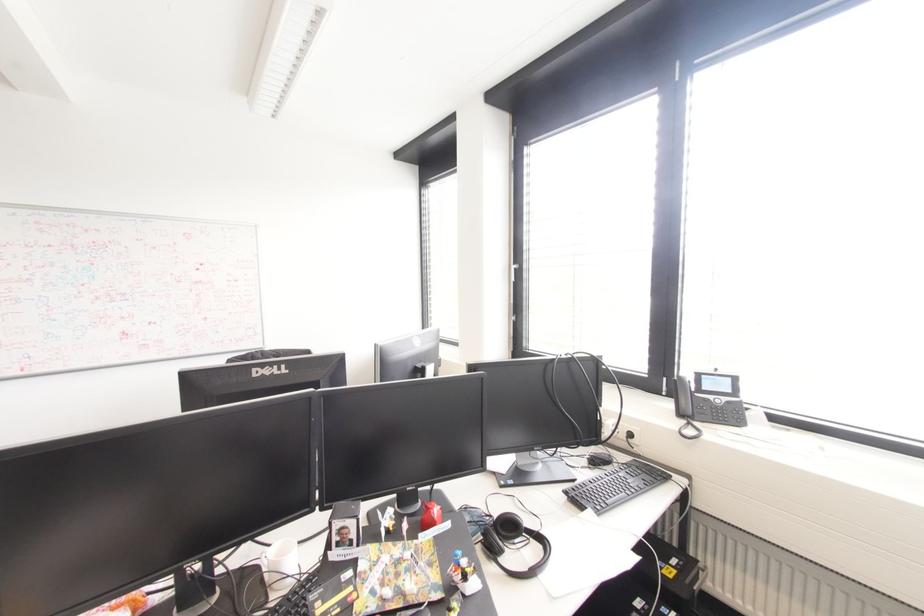
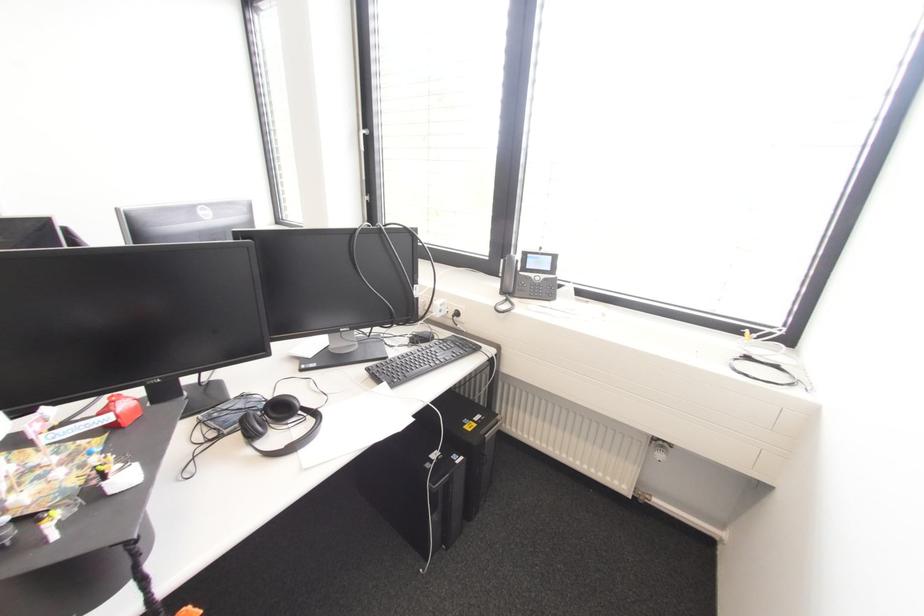
Question: I am providing you with two images of the same scene from different viewpoints. Which of the following objects are not visible in image2?

Choices:
 (A) black computer mouse
 (B) phone handset
 (C) silver window handle
 (D) none of these

Answer: (D)